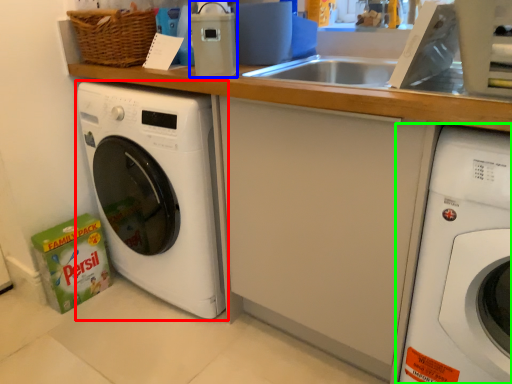
Question: Based on their relative distances, which object is nearer to washing machine (highlighted by a red box)? Choose from appliance (highlighted by a blue box) and washing machine (highlighted by a green box).

Choices:
 (A) appliance
 (B) washing machine

Answer: (A)